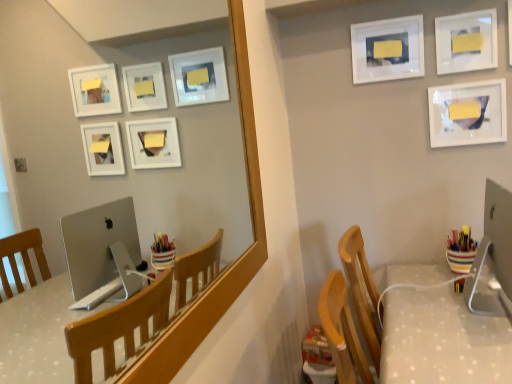
This screenshot has width=512, height=384. Find the location of `unoccupied space behind sleek silver monitor at right`. unoccupied space behind sleek silver monitor at right is located at coordinates (431, 281).